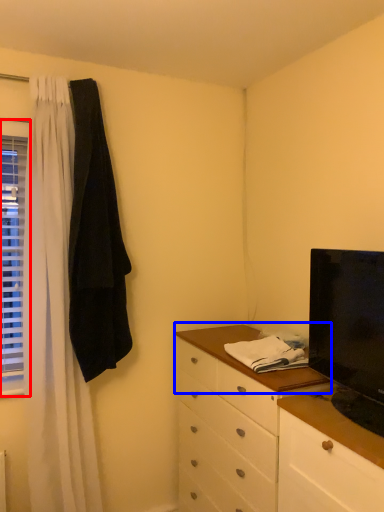
Question: Among these objects, which one is nearest to the camera, window (highlighted by a red box) or counter top (highlighted by a blue box)?

Choices:
 (A) window
 (B) counter top

Answer: (B)